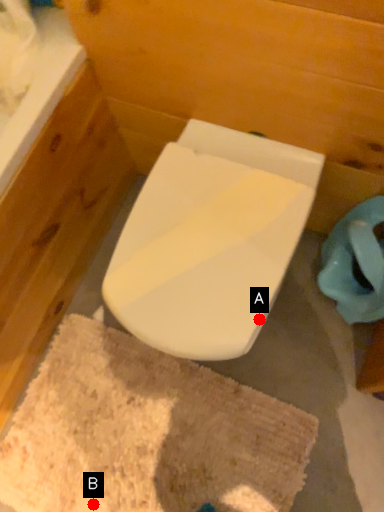
Question: Two points are circled on the image, labeled by A and B beside each circle. Among these points, which one is nearest to the camera?

Choices:
 (A) A is closer
 (B) B is closer

Answer: (A)